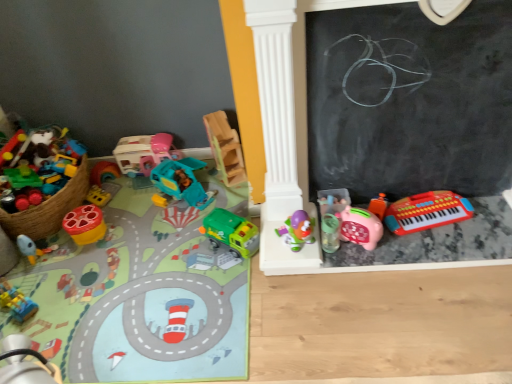
Find the location of a particular element. The height and width of the screenshot is (384, 512). free space on the front side of green plastic toy truck at center, placed as the eighth toy when sorted from left to right is located at coordinates (228, 276).